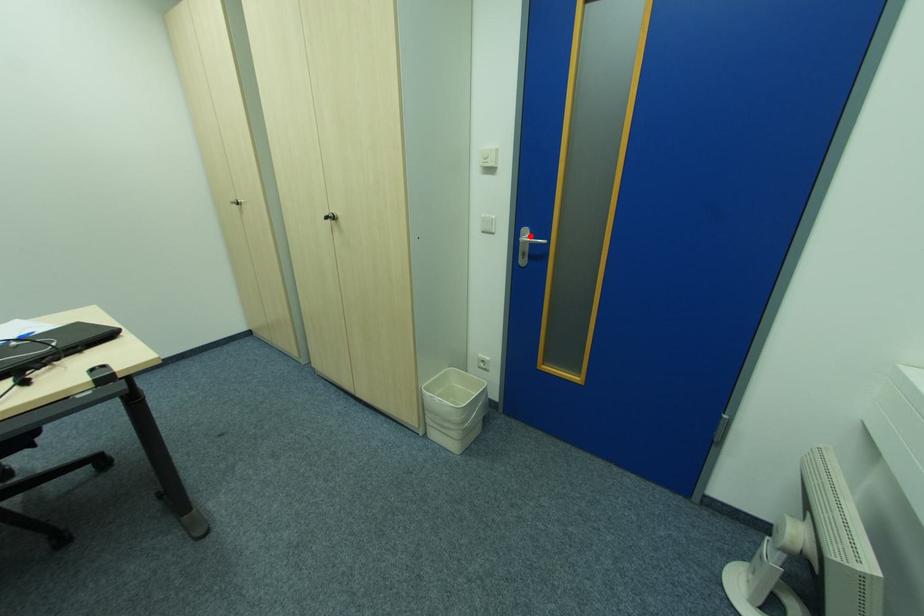
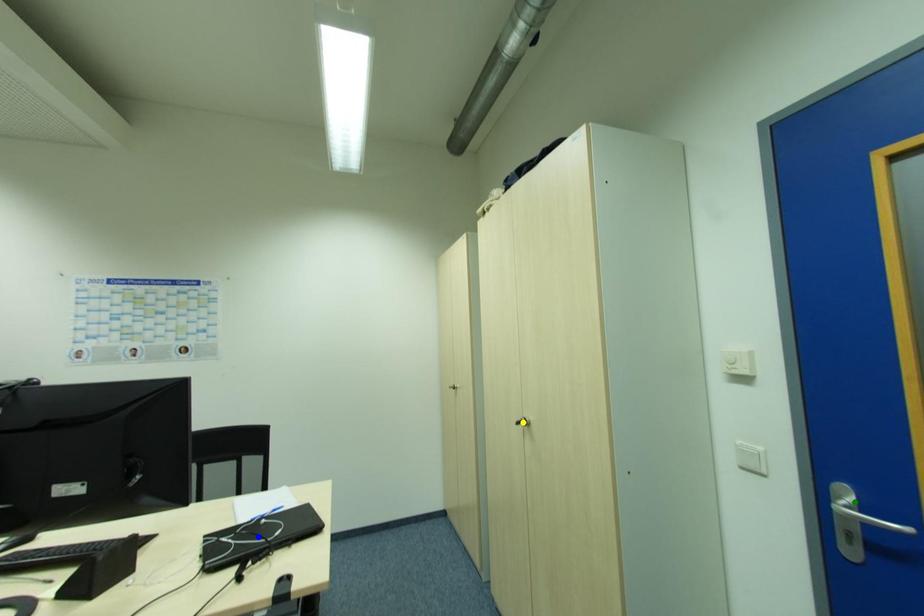
Question: I am providing you with two images of the same scene from different viewpoints. A red point is marked on the first image. You are given multiple points on the second image. In image 2, which mark is for the same physical point as the one in image 1?

Choices:
 (A) yellow point
 (B) blue point
 (C) green point

Answer: (C)